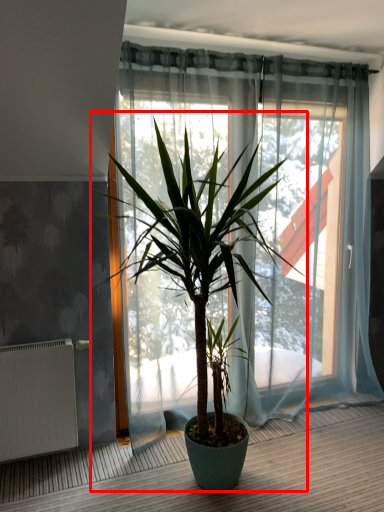
Question: Considering the relative positions of houseplant (annotated by the red box) and radiator in the image provided, where is houseplant (annotated by the red box) located with respect to the staircase?

Choices:
 (A) right
 (B) left

Answer: (A)